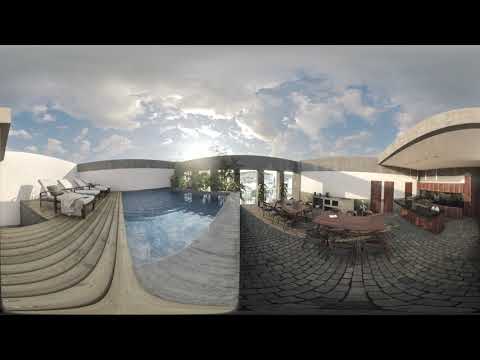
The image size is (480, 360). Find the location of `wall`. wall is located at coordinates (129, 178).